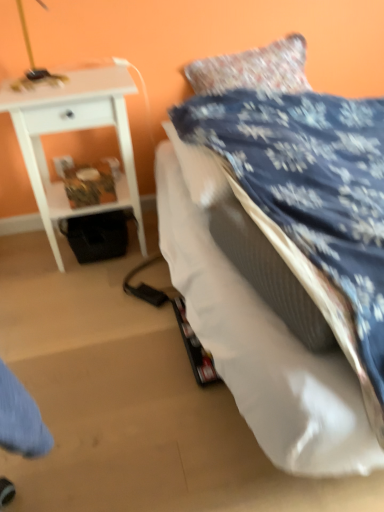
Question: From a real-world perspective, relative to blue fabric bed at upper right, is white glossy nightstand at upper left vertically above or below?

Choices:
 (A) below
 (B) above

Answer: (B)

Question: Considering the positions of white glossy nightstand at upper left and blue fabric bed at upper right in the image, is white glossy nightstand at upper left bigger or smaller than blue fabric bed at upper right?

Choices:
 (A) big
 (B) small

Answer: (B)

Question: Does point (114, 76) appear closer or farther from the camera than point (331, 441)?

Choices:
 (A) closer
 (B) farther

Answer: (B)

Question: Visually, is blue fabric bed at upper right positioned to the left or to the right of white glossy nightstand at upper left?

Choices:
 (A) right
 (B) left

Answer: (A)

Question: Is blue fabric bed at upper right situated inside white glossy nightstand at upper left or outside?

Choices:
 (A) outside
 (B) inside

Answer: (A)

Question: From a real-world perspective, is blue fabric bed at upper right physically located above or below white glossy nightstand at upper left?

Choices:
 (A) below
 (B) above

Answer: (A)

Question: Is blue fabric bed at upper right wider or thinner than white glossy nightstand at upper left?

Choices:
 (A) wide
 (B) thin

Answer: (A)